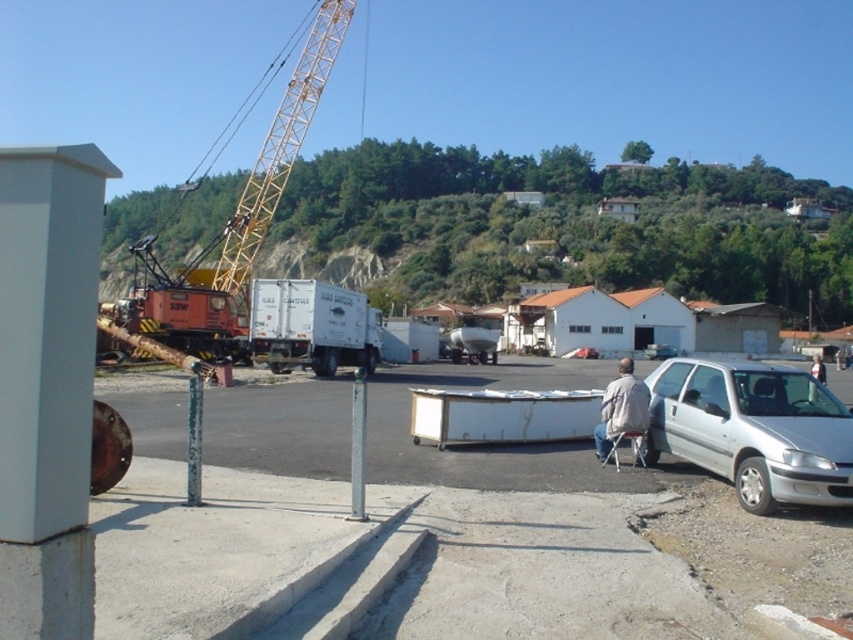
You are a delivery driver who needs to park your truck on the right side of the light gray fabric jacket at lower right. Is the white matte trailer truck at center currently in a position that allows you to do so?

The white matte trailer truck at center is positioned on the left side of light gray fabric jacket at lower right, so it is already occupying the left side. To park on the right side of the jacket, you would need to position your truck to the right of it, which is currently unoccupied. Therefore, you can park there as long as there is space available on the right side.

Consider the image. You are an inspector who needs to determine if the white matte table at center can be placed on the white matte trailer truck at center. Based on their widths, can the table fit on the trailer?

The white matte table at center is wider than the white matte trailer truck at center, so it cannot fit on the trailer.

You are standing at the construction site and want to determine the relative positions of two points marked in the scene. Which point, point 1 at coordinates (265, 339) or point 2 at coordinates (625, 428), is closer to your viewpoint?

Point 1 at coordinates (265, 339) is closer to your viewpoint because it is further to the camera than point 2 at coordinates (625, 428).